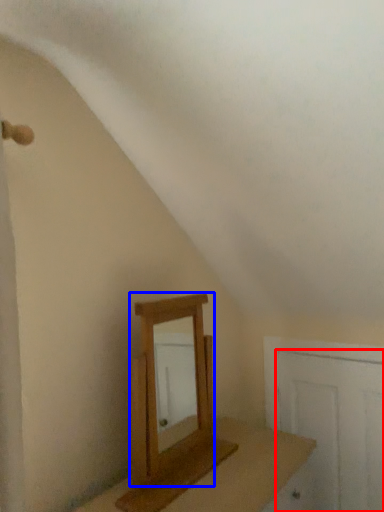
Question: Which object is further to the camera taking this photo, door (highlighted by a red box) or mirror (highlighted by a blue box)?

Choices:
 (A) door
 (B) mirror

Answer: (A)